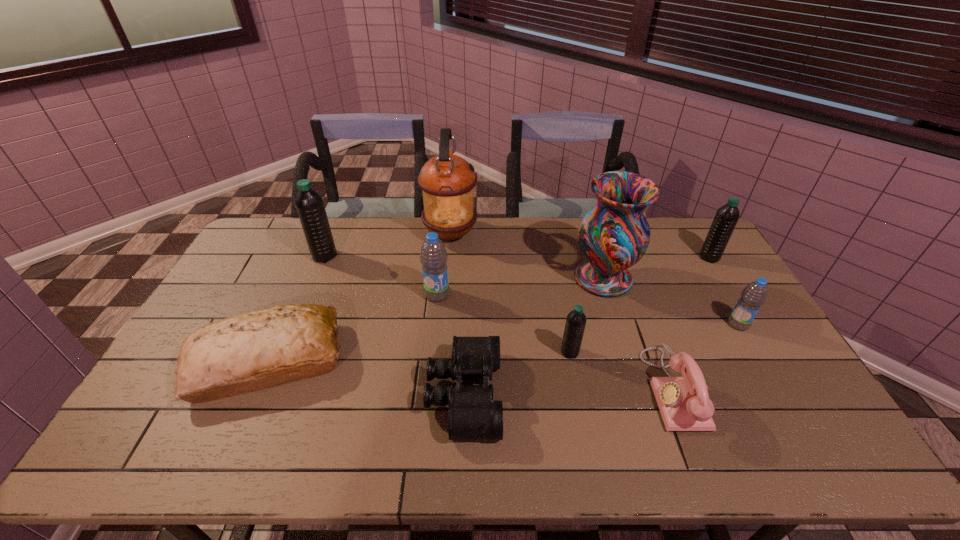
The height and width of the screenshot is (540, 960). I want to click on the right blue water bottle, so click(754, 295).

Image resolution: width=960 pixels, height=540 pixels. I want to click on bread, so click(x=262, y=349).

This screenshot has width=960, height=540. I want to click on pink telephone, so click(684, 403).

At what (x,y) coordinates should I click in order to perform the action: click on black binoculars. Please return your answer as a coordinate pair (x, y). The width and height of the screenshot is (960, 540). Looking at the image, I should click on (473, 414).

Image resolution: width=960 pixels, height=540 pixels. Find the location of `binoculars`. binoculars is located at coordinates (473, 414).

Identify the location of vacant region located 0.380m on the right of the oil lamp. (577, 234).

At what (x,y) coordinates should I click in order to perform the action: click on free space located 0.270m on the right of the vase. Please return your answer as a coordinate pair (x, y). This screenshot has width=960, height=540. Looking at the image, I should click on (714, 278).

Identify the location of vacant space located on the left of the leftmost water bottle. (249, 256).

The width and height of the screenshot is (960, 540). In order to click on vacant position located on the front of the rightmost black water bottle in this screenshot , I will do tap(721, 277).

The width and height of the screenshot is (960, 540). Identify the location of vacant space located 0.200m on the back of the third nearest water bottle. (442, 248).